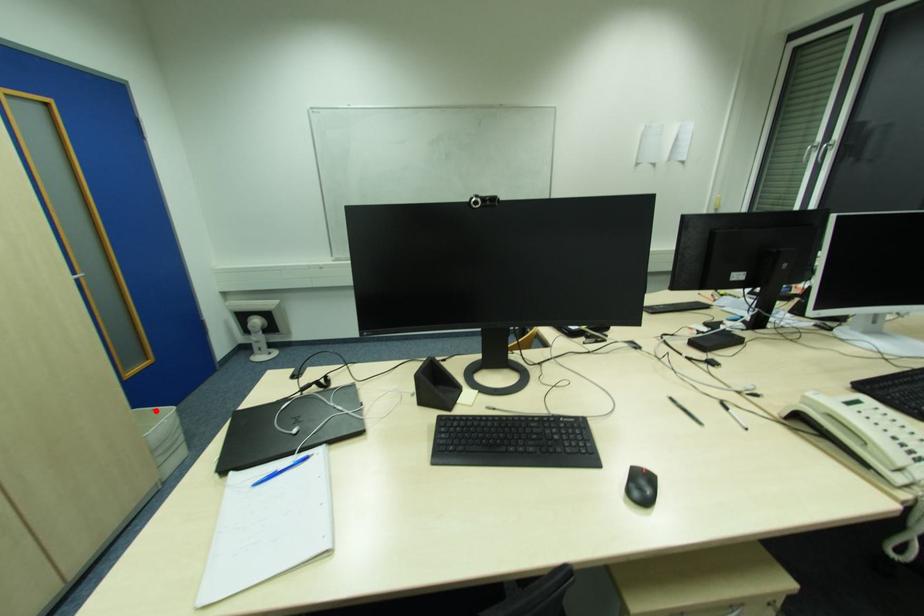
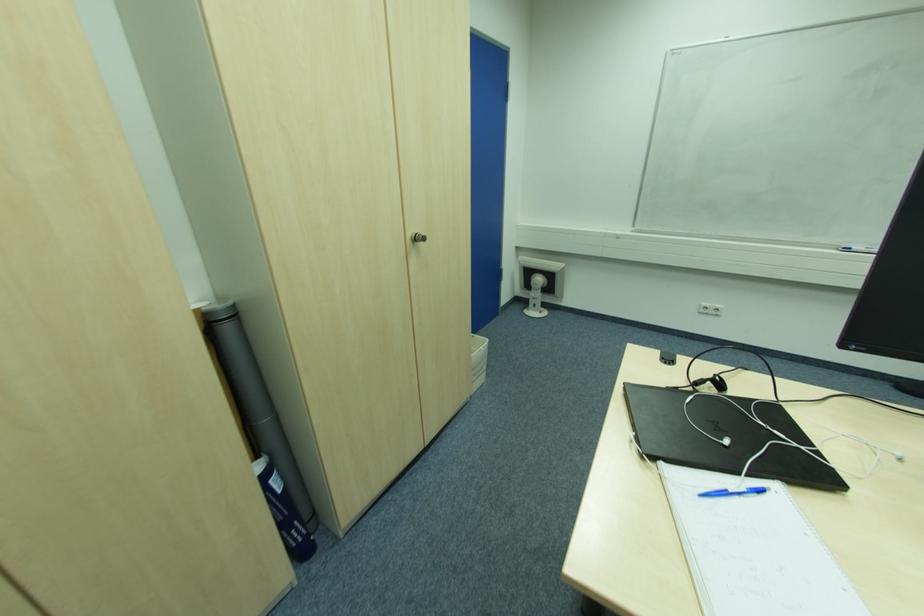
Question: I am providing you with two images of the same scene from different viewpoints. A red point is shown in image1. For the corresponding object point in image2, is it positioned nearer or farther from the camera?

Choices:
 (A) Nearer
 (B) Farther

Answer: (B)